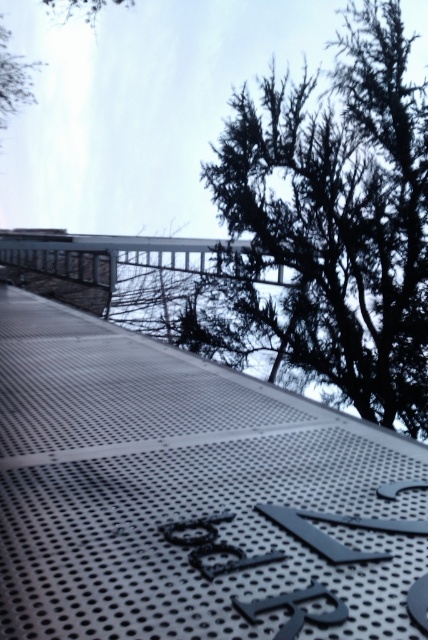
You are standing on the metallic perforated ramp at center and want to reach the dark green textured tree at upper right. Considering their sizes, which one is wider?

The metallic perforated ramp at center is wider than the dark green textured tree at upper right according to the description.

Based on the photo, you are standing on the metallic perforated ramp at center and want to walk towards the dark green textured tree at upper right. Which direction should you move to get closer to the tree?

Since the metallic perforated ramp at center is closer to the viewer than the dark green textured tree at upper right, you should move forward along the ramp towards the tree to get closer.

You are standing on the metallic perforated ramp at center and want to look up at the dark green textured tree at upper right. Can you see the tree from your current position?

Yes, the metallic perforated ramp at center is located below the dark green textured tree at upper right, so you can see the tree from your current position.